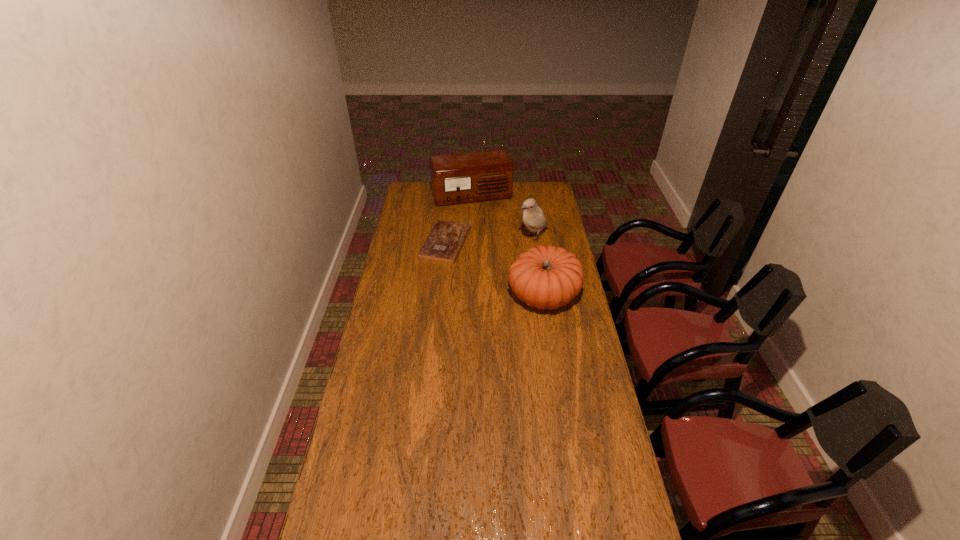
Locate an element on the screen. blank space located 0.280m at the beak of the bird is located at coordinates (484, 270).

At what (x,y) coordinates should I click in order to perform the action: click on free point located at the beak of the bird. Please return your answer as a coordinate pair (x, y). This screenshot has height=540, width=960. Looking at the image, I should click on (512, 252).

Identify the location of object at the far edge. (462, 178).

Find the location of a particular element. The width and height of the screenshot is (960, 540). Bible located at the left edge is located at coordinates (445, 241).

Find the location of a particular element. radio receiver that is positioned at the left edge is located at coordinates (462, 178).

The image size is (960, 540). Identify the location of pumpkin at the right edge. (546, 277).

Identify the location of bird positioned at the right edge. (533, 218).

Where is `object located in the far left corner section of the desktop`? The image size is (960, 540). object located in the far left corner section of the desktop is located at coordinates (462, 178).

The image size is (960, 540). I want to click on blank area at the far edge, so click(490, 202).

In the image, there is a desktop. Where is `free region at the right edge`? The height and width of the screenshot is (540, 960). free region at the right edge is located at coordinates (583, 325).